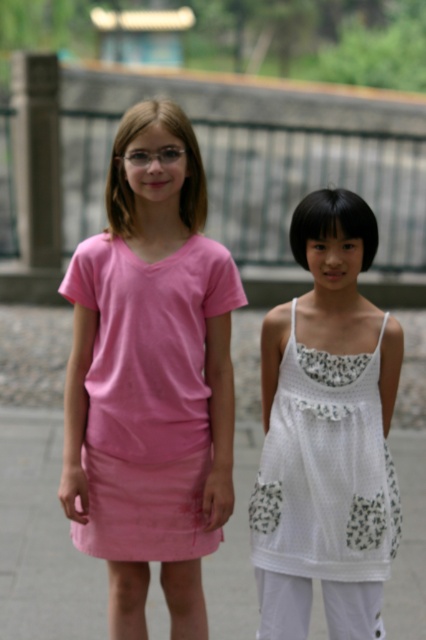
Question: Does matte pink dress at center lie in front of white crochet dress at center?

Choices:
 (A) no
 (B) yes

Answer: (A)

Question: Which object is positioned farthest from the white crochet dress at center?

Choices:
 (A) matte pink dress at center
 (B) pink fabric skirt at lower center

Answer: (B)

Question: Can you confirm if matte pink dress at center is wider than pink fabric skirt at lower center?

Choices:
 (A) yes
 (B) no

Answer: (B)

Question: Which object appears closest to the camera in this image?

Choices:
 (A) white crochet dress at center
 (B) pink fabric skirt at lower center

Answer: (A)

Question: Does pink fabric skirt at lower center lie in front of white crochet dress at center?

Choices:
 (A) yes
 (B) no

Answer: (B)

Question: Among these objects, which one is farthest from the camera?

Choices:
 (A) pink fabric skirt at lower center
 (B) matte pink dress at center
 (C) white crochet dress at center

Answer: (A)